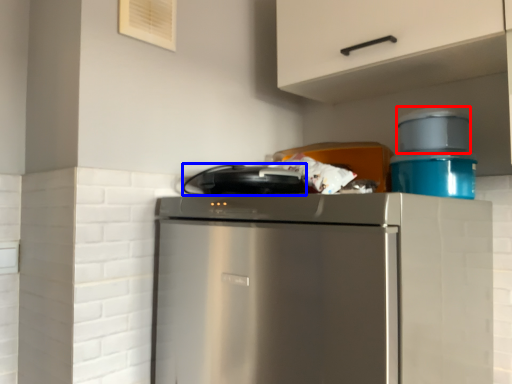
Question: Which object is closer to the camera taking this photo, appliance (highlighted by a red box) or appliance (highlighted by a blue box)?

Choices:
 (A) appliance
 (B) appliance

Answer: (B)